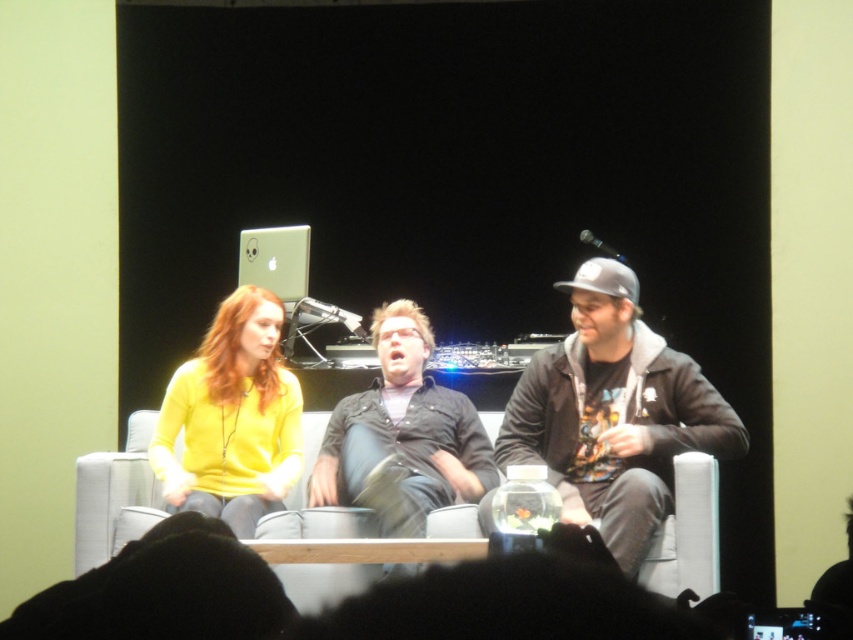
You are standing in front of the couch where three people are sitting. You notice a specific point at coordinates (613, 413). Which object from the scene is this point located on?

The point at coordinates (613, 413) is located on the dark gray hoodie at center.

Looking at this image, you are an interior designer planning to place a new lamp on the couch where the black matte shirt at center is currently located. The lamp requires a 10x10 cm space. Can you confirm if there is enough space at that exact point?

The black matte shirt at center is located at point (402, 435), so yes, there is enough space to place the lamp there as the coordinates indicate an exact spot where the shirt is placed, and the required space is manageable.

You are a photographer setting up a shoot in the scene. You need to place a small prop on the dark gray hoodie at center so that it won not be hidden by the gray fabric couch at center. Where should you place the prop?

The dark gray hoodie at center is in front of the gray fabric couch at center, so placing the prop on the dark gray hoodie at center will ensure it remains visible and not hidden by the couch.